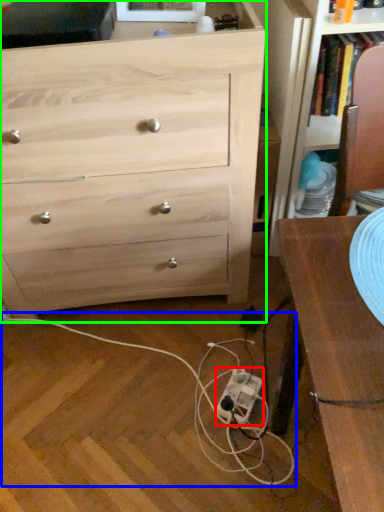
Question: Which object is positioned closest to extension cord (highlighted by a red box)? Select from string (highlighted by a blue box) and chest of drawers (highlighted by a green box).

Choices:
 (A) string
 (B) chest of drawers

Answer: (A)